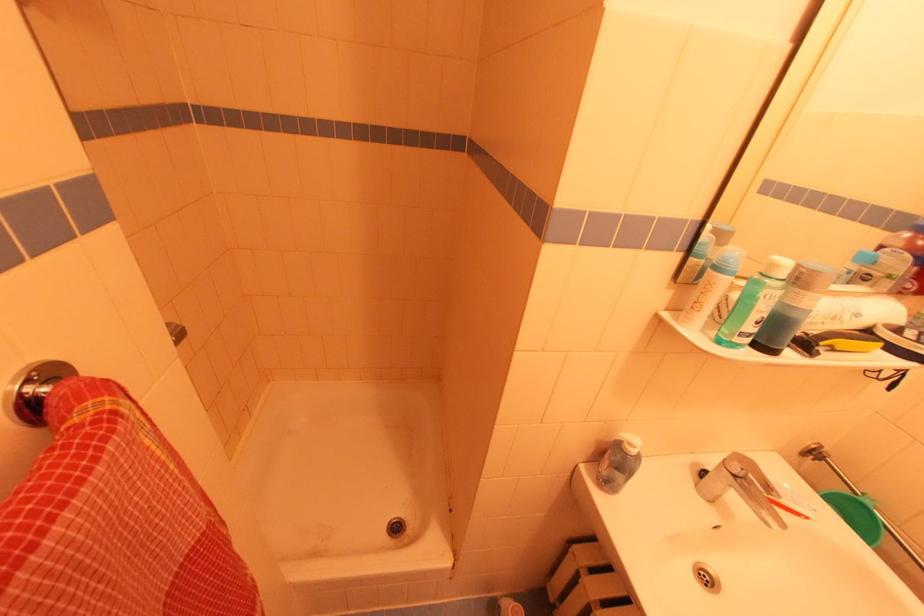
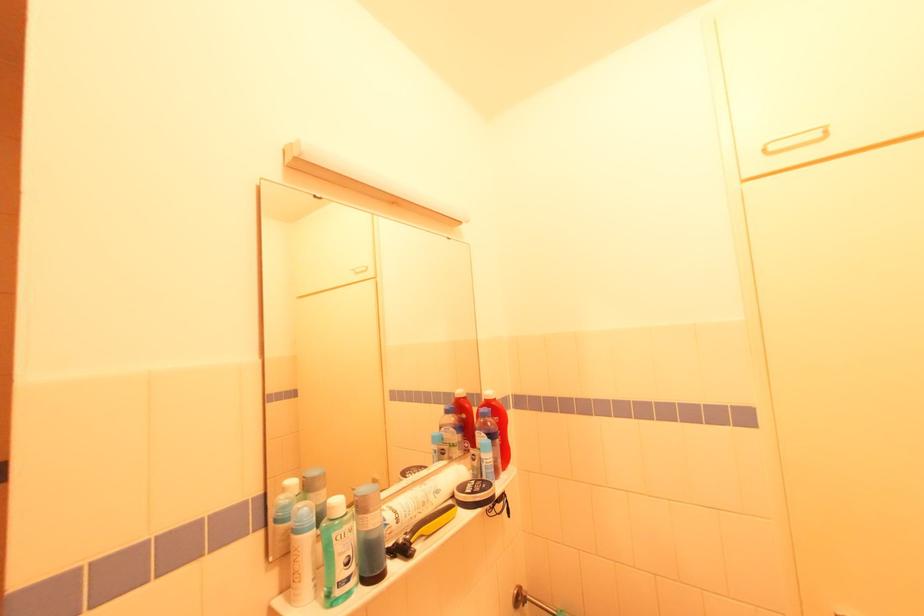
Find the pixel in the second image that matches point 815,447 in the first image.

(517, 594)